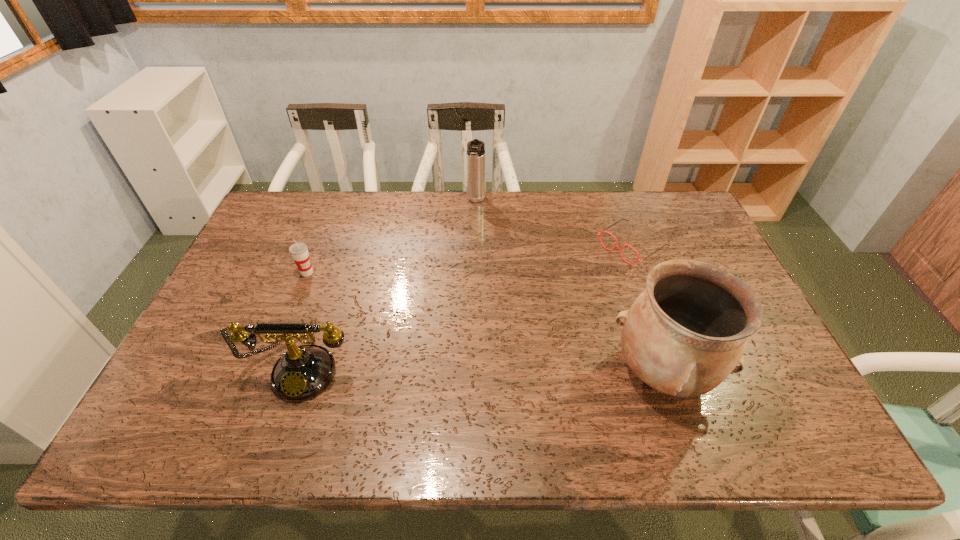
Identify the location of vacant spot on the desktop that is between the third tallest object and the tallest object and is positioned on the front-facing side of the shortest object. (443, 369).

Identify the location of vacant space on the desktop that is between the third shortest object and the tallest object and is positioned on the side of the cup with the logo. (468, 369).

Where is `vacant space on the desktop that is between the third tallest object and the urn and is positioned on the handle side of the third object from right to left`? vacant space on the desktop that is between the third tallest object and the urn and is positioned on the handle side of the third object from right to left is located at coordinates (441, 369).